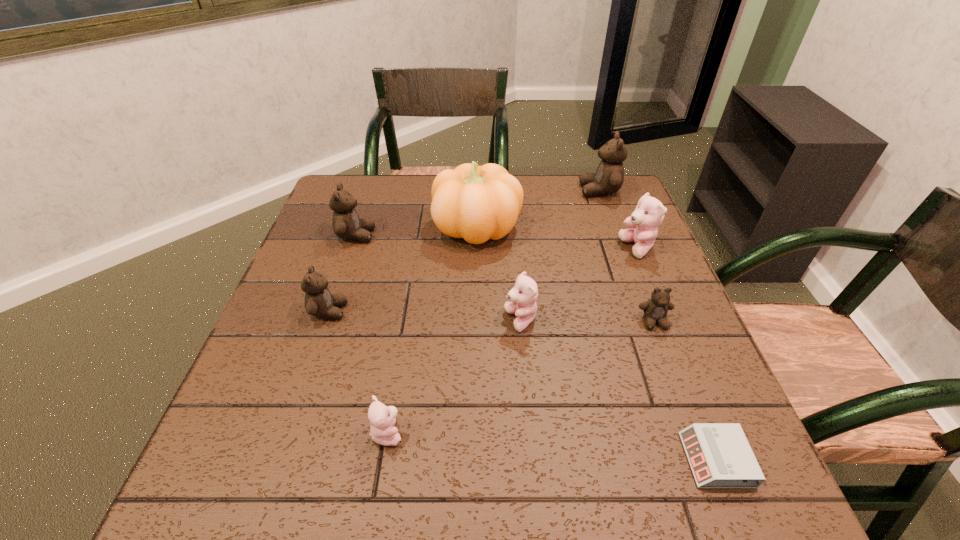
At what (x,y) coordinates should I click in order to perform the action: click on object situated at the near edge. Please return your answer as a coordinate pair (x, y). Looking at the image, I should click on (720, 456).

Locate an element on the screen. This screenshot has height=540, width=960. alarm clock located at the right edge is located at coordinates (720, 456).

Find the location of `object positioned at the far right corner`. object positioned at the far right corner is located at coordinates (609, 177).

Identify the location of object located at the near right corner. (720, 456).

The height and width of the screenshot is (540, 960). Find the location of `vacant space at the far edge of the desktop`. vacant space at the far edge of the desktop is located at coordinates click(x=572, y=178).

Identify the location of free location at the near edge of the desktop. (463, 461).

This screenshot has width=960, height=540. Find the location of `free space at the left edge of the desktop`. free space at the left edge of the desktop is located at coordinates (262, 408).

In the image, there is a desktop. Where is `free space at the right edge`? free space at the right edge is located at coordinates (635, 314).

The image size is (960, 540). Identify the location of blank space at the far left corner of the desktop. (364, 192).

At what (x,y) coordinates should I click in order to perform the action: click on vacant position at the far right corner of the desktop. Please return your answer as a coordinate pair (x, y). Image resolution: width=960 pixels, height=540 pixels. Looking at the image, I should click on click(x=624, y=180).